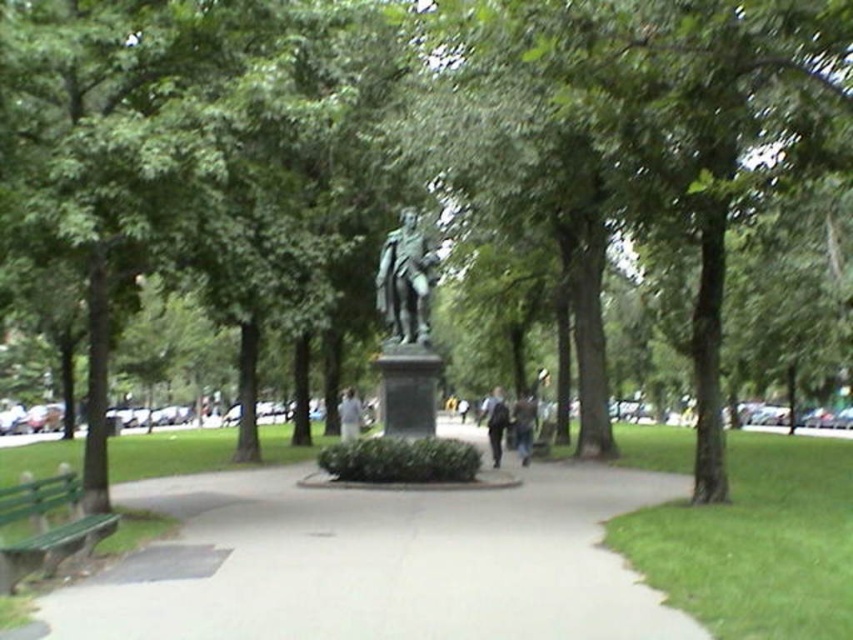
Which is more to the right, green wooden bench at lower left or dark blue jeans at center?

dark blue jeans at center is more to the right.

Between green wooden bench at lower left and dark blue jeans at center, which one is positioned higher?

Positioned higher is green wooden bench at lower left.

Between point (71, 545) and point (503, 412), which one is positioned behind?

The point (503, 412) is more distant.

Identify the location of green wooden bench at lower left. The width and height of the screenshot is (853, 640). (45, 528).

Is point (502, 420) positioned behind point (457, 404)?

No, it is in front of (457, 404).

Between dark blue jeans at center and light brown leather jacket at center, which one is positioned higher?

Positioned higher is dark blue jeans at center.

What are the coordinates of `dark blue jeans at center` in the screenshot? It's located at (495, 422).

Identify the location of dark blue jeans at center. (495, 422).

Is point (24, 490) closer to camera compared to point (462, 420)?

Yes, it is.

Does green wooden bench at lower left have a larger size compared to light brown leather jacket at center?

Actually, green wooden bench at lower left might be smaller than light brown leather jacket at center.

Does point (33, 563) lie behind point (463, 417)?

No, (33, 563) is in front of (463, 417).

I want to click on green wooden bench at lower left, so click(45, 528).